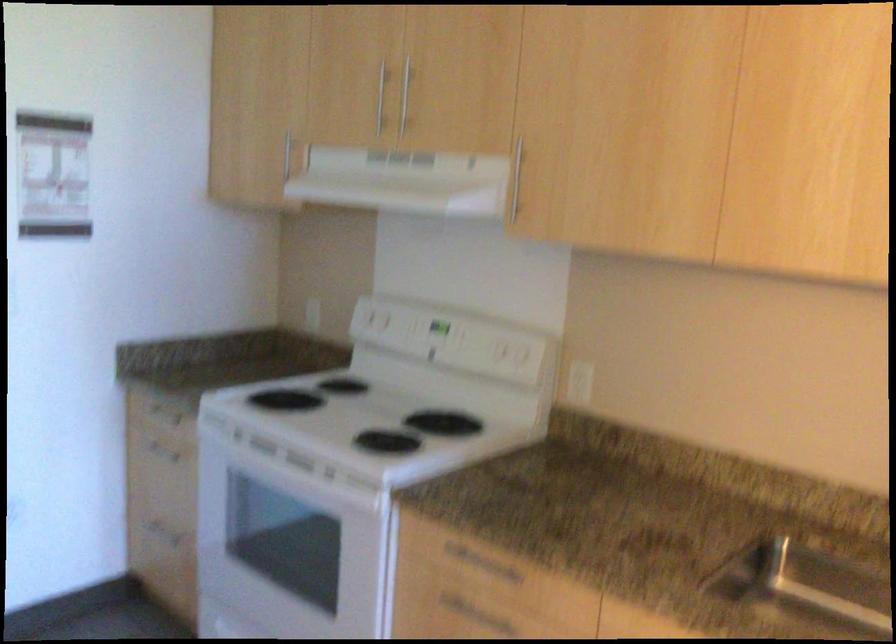
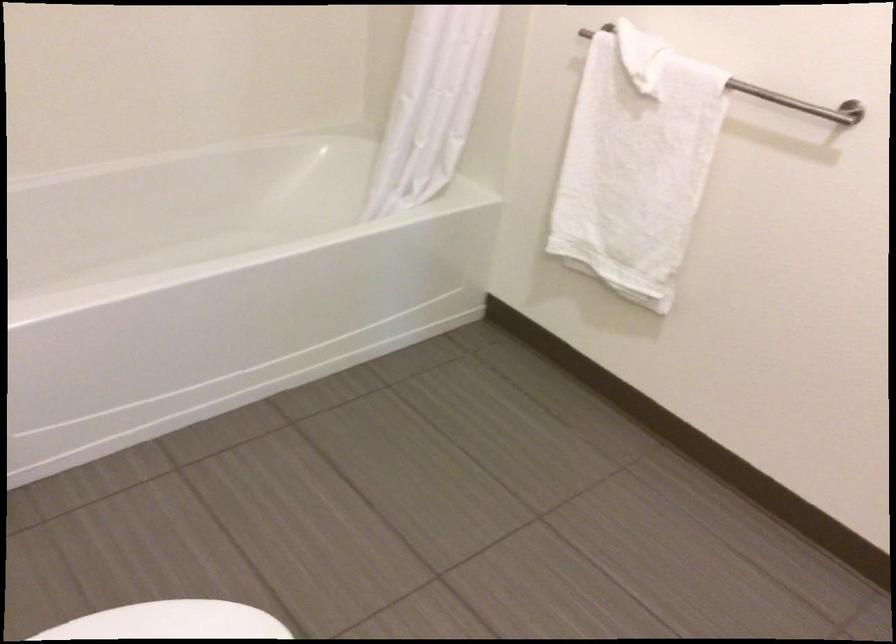
In a continuous first-person perspective shot, in which direction is the camera moving?

The cameraman moved toward left, backward.